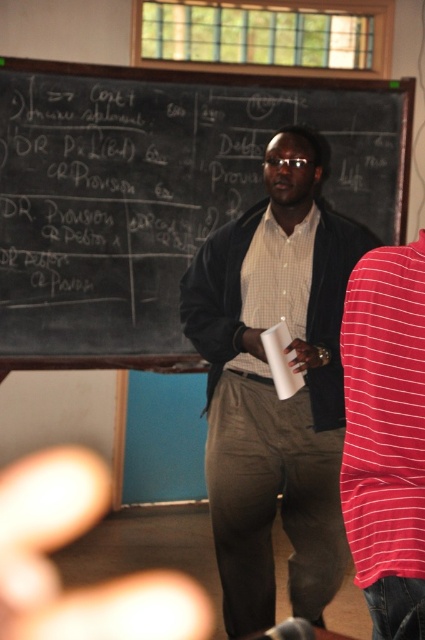
Question: Is matte black jacket at center wider than white matte paper cup at center?

Choices:
 (A) no
 (B) yes

Answer: (B)

Question: Which object is positioned closest to the blackboard at upper center?

Choices:
 (A) matte black jacket at center
 (B) white matte paper cup at center
 (C) checkered fabric shirt at center

Answer: (A)

Question: Considering the real-world distances, which object is farthest from the matte black jacket at center?

Choices:
 (A) white matte paper cup at center
 (B) blackboard at upper center
 (C) checkered fabric shirt at center

Answer: (B)

Question: Can you confirm if blackboard at upper center is thinner than matte black jacket at center?

Choices:
 (A) yes
 (B) no

Answer: (B)

Question: Does blackboard at upper center have a lesser width compared to white matte paper cup at center?

Choices:
 (A) no
 (B) yes

Answer: (A)

Question: Which of the following is the closest to the observer?

Choices:
 (A) white matte paper cup at center
 (B) blackboard at upper center

Answer: (A)